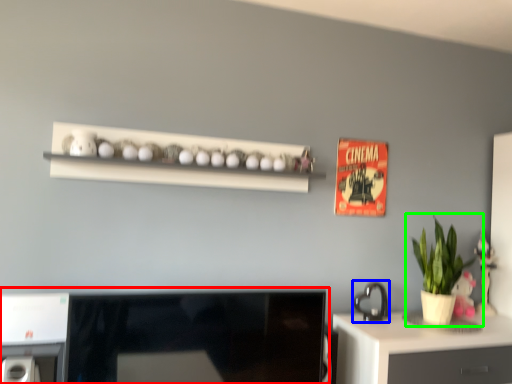
Question: Estimate the real-world distances between objects in this image. Which object is farther from desktop (highlighted by a red box), appliance (highlighted by a blue box) or houseplant (highlighted by a green box)?

Choices:
 (A) appliance
 (B) houseplant

Answer: (B)